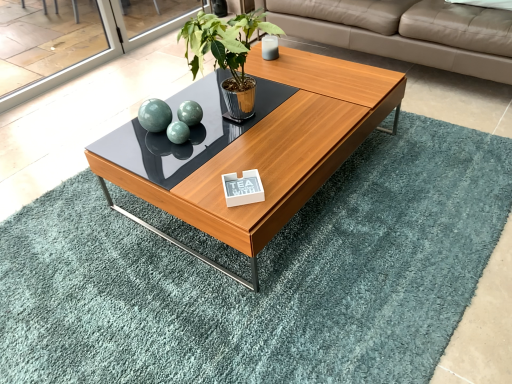
Identify the location of vacant area that lies to the right of white glossy plaque at center. Image resolution: width=512 pixels, height=384 pixels. (281, 179).